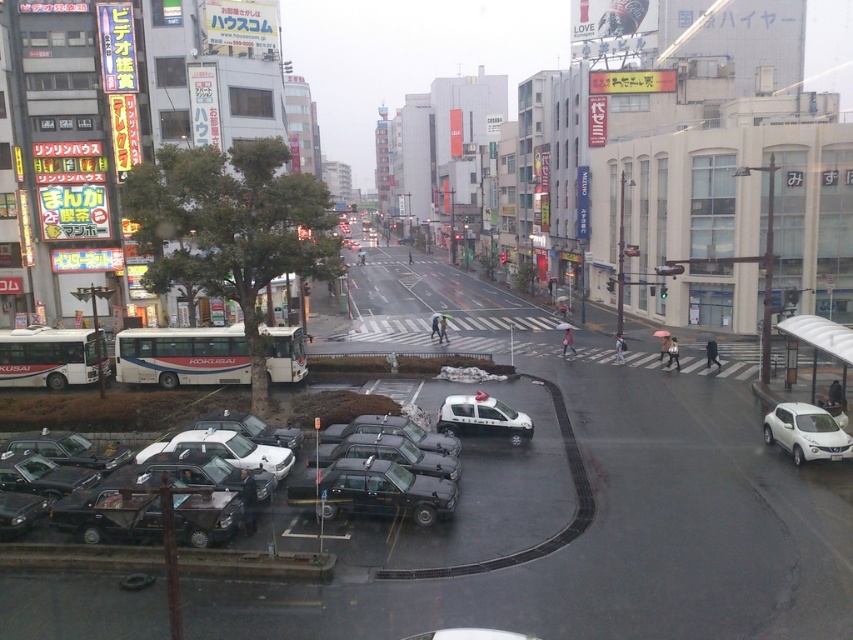
Does black rubber taxi at lower left have a lesser width compared to white glossy car at center?

Incorrect, black rubber taxi at lower left's width is not less than white glossy car at center's.

Between black rubber taxi at lower left and white glossy car at center, which one has less height?

Standing shorter between the two is white glossy car at center.

Between point (392, 472) and point (474, 394), which one is positioned behind?

Point (474, 394)

In order to click on black rubber taxi at lower left in this screenshot , I will do `click(393, 493)`.

Find the location of a particular element. The image size is (853, 640). black rubber taxi at lower left is located at coordinates (393, 493).

Measure the distance from black rubber taxi at lower left to white matte suv at lower right.

They are 12.68 meters apart.

Where is `black rubber taxi at lower left`? The width and height of the screenshot is (853, 640). black rubber taxi at lower left is located at coordinates (393, 493).

The height and width of the screenshot is (640, 853). I want to click on black rubber taxi at lower left, so click(393, 493).

Is point (792, 404) positioned behind point (457, 426)?

No, (792, 404) is closer to viewer.

Between white matte suv at lower right and white glossy car at center, which one appears on the left side from the viewer's perspective?

white glossy car at center

This screenshot has height=640, width=853. What do you see at coordinates (805, 433) in the screenshot?
I see `white matte suv at lower right` at bounding box center [805, 433].

Find the location of a particular element. The height and width of the screenshot is (640, 853). white matte suv at lower right is located at coordinates (805, 433).